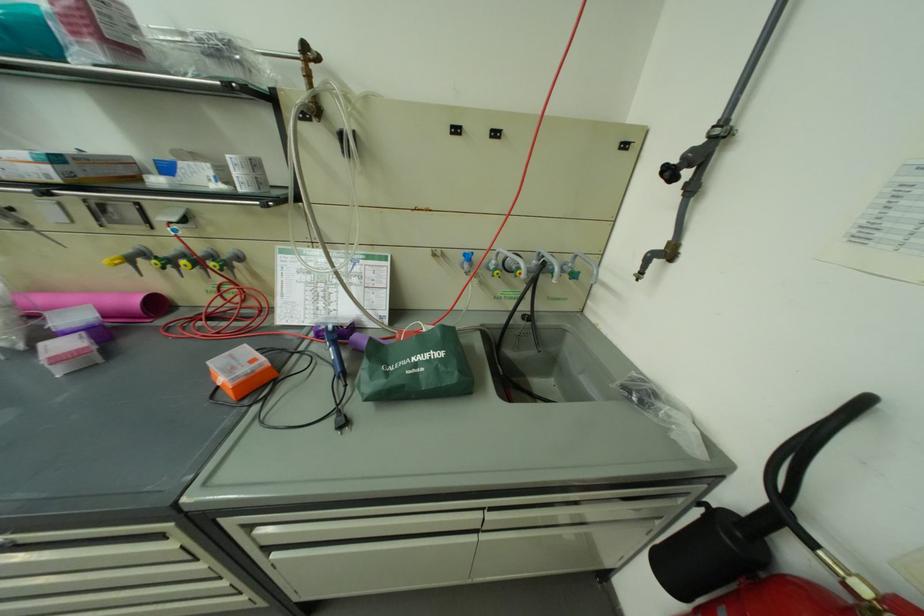
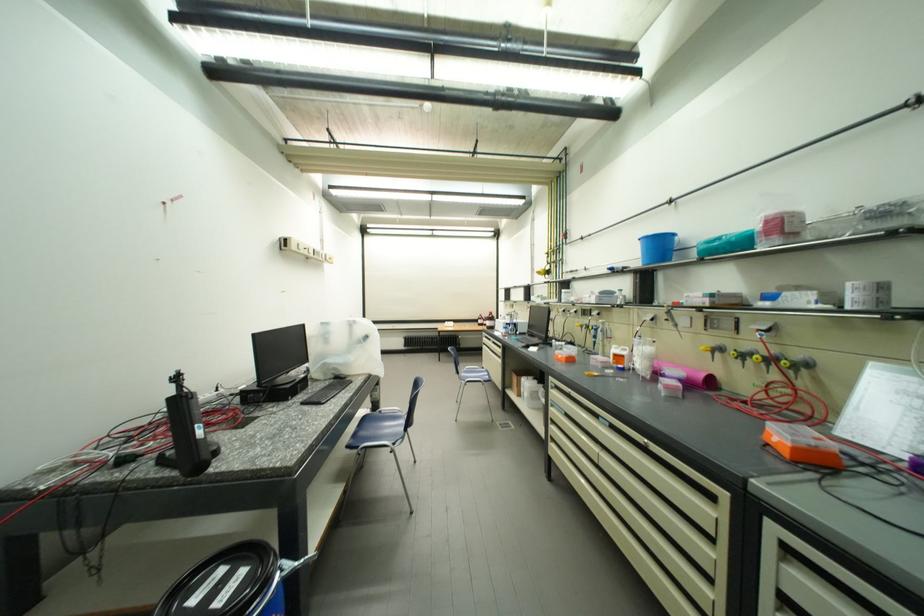
Find the pixel in the second image that matches pixel 55 329 in the first image.

(672, 374)